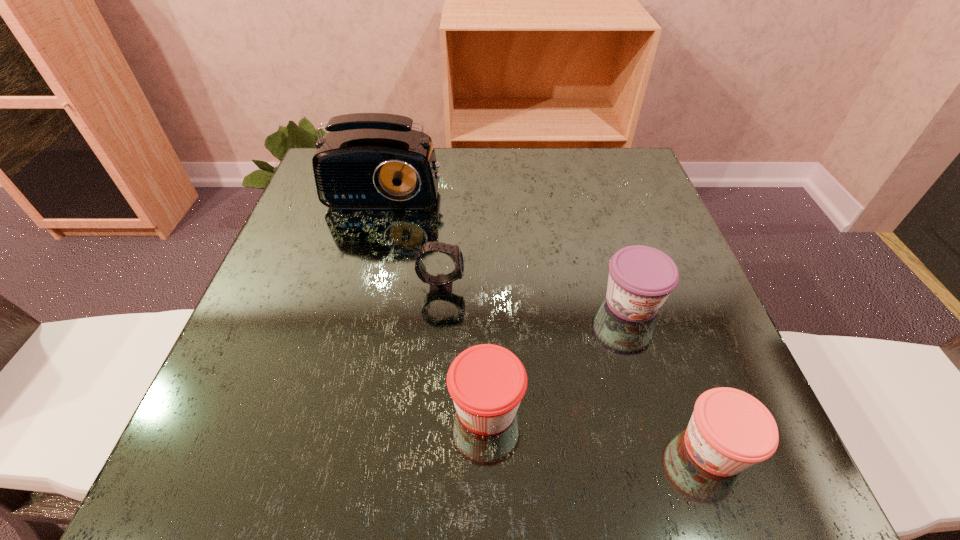
I want to click on the second closest jam to the farthest jam, so click(487, 382).

Where is `free space in the image that satisfies the following two spatial constraints: 1. on the front label of the farthest jam; 2. on the label side of the leftmost jam`? This screenshot has width=960, height=540. free space in the image that satisfies the following two spatial constraints: 1. on the front label of the farthest jam; 2. on the label side of the leftmost jam is located at coordinates (664, 407).

Find the location of `vacant space that satisfies the following two spatial constraints: 1. on the front label of the farthest jam; 2. on the label side of the leftmost jam`. vacant space that satisfies the following two spatial constraints: 1. on the front label of the farthest jam; 2. on the label side of the leftmost jam is located at coordinates (664, 407).